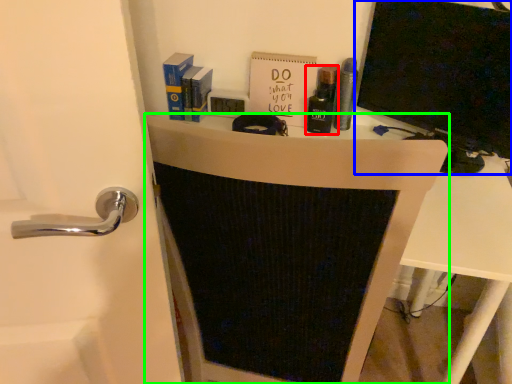
Question: Based on their relative distances, which object is nearer to toiletry (highlighted by a red box)? Choose from wide (highlighted by a blue box) and furniture (highlighted by a green box).

Choices:
 (A) wide
 (B) furniture

Answer: (A)